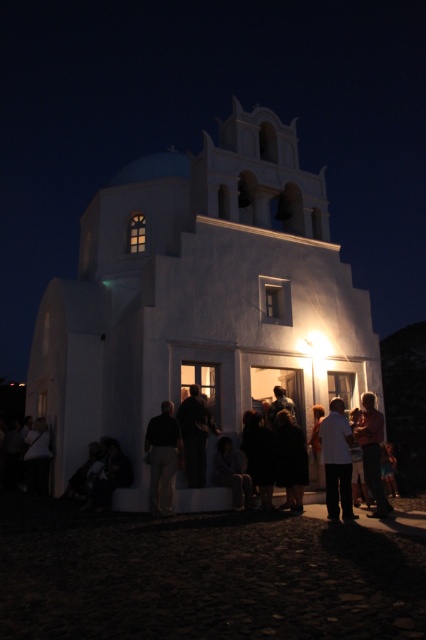
Question: Considering the real-world distances, which object is farthest from the white matte shirt at center?

Choices:
 (A) matte pink shirt at right
 (B) dark fabric coat at center

Answer: (B)

Question: Which of the following is the closest to the observer?

Choices:
 (A) white matte shirt at center
 (B) matte pink shirt at right
 (C) dark clothing crowd at center
 (D) white matte church at center

Answer: (A)

Question: Observing the image, what is the correct spatial positioning of white matte shirt at center in reference to dark clothing crowd at center?

Choices:
 (A) right
 (B) left

Answer: (A)

Question: Which point is farther from the camera taking this photo?

Choices:
 (A) (371, 436)
 (B) (192, 460)

Answer: (A)

Question: In this image, where is matte pink shirt at right located relative to dark clothing crowd at center?

Choices:
 (A) right
 (B) left

Answer: (A)

Question: Observing the image, what is the correct spatial positioning of dark gray pants at center in reference to dark clothing crowd at center?

Choices:
 (A) above
 (B) below

Answer: (A)